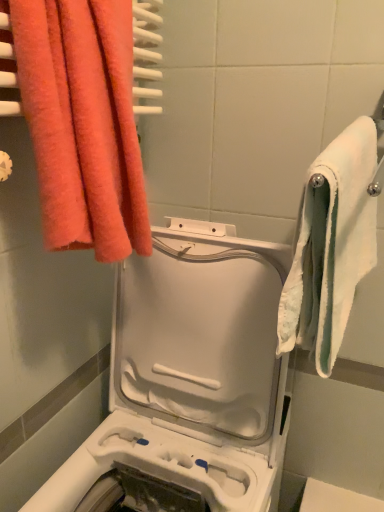
Question: Is white soft towel at right, the first towel in the right-to-left sequence, wider or thinner than white plastic washing machine at center?

Choices:
 (A) thin
 (B) wide

Answer: (A)

Question: From a real-world perspective, is white soft towel at right, placed as the second towel when sorted from left to right, physically located above or below white plastic washing machine at center?

Choices:
 (A) above
 (B) below

Answer: (A)

Question: Considering the real-world distances, which object is farthest from the white plastic washing machine at center?

Choices:
 (A) white fabric towel at right
 (B) fluffy coral towel at upper left, which is the 1th towel in left-to-right order
 (C) white soft towel at right, placed as the second towel when sorted from left to right

Answer: (A)

Question: Which of these objects is positioned farthest from the white plastic washing machine at center?

Choices:
 (A) white fabric towel at right
 (B) fluffy coral towel at upper left, the 2th towel in the right-to-left sequence
 (C) white soft towel at right, placed as the second towel when sorted from left to right

Answer: (A)